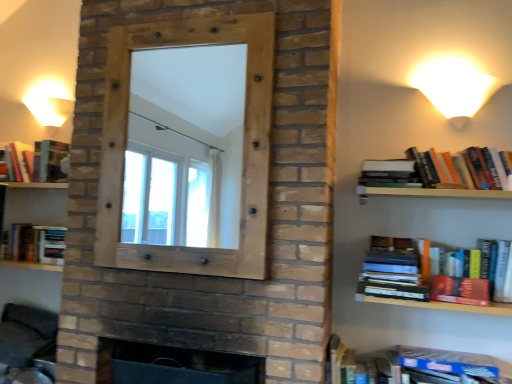
Question: Is dark brick fireplace at center further to camera compared to hardcover book at upper right, positioned as the 3th book in left-to-right order?

Choices:
 (A) no
 (B) yes

Answer: (A)

Question: From a real-world perspective, is dark brick fireplace at center over hardcover book at upper right, positioned as the 3th book in left-to-right order?

Choices:
 (A) no
 (B) yes

Answer: (A)

Question: Is hardcover book at upper right, positioned as the 3th book in left-to-right order, at the back of dark brick fireplace at center?

Choices:
 (A) no
 (B) yes

Answer: (A)

Question: Can you confirm if dark brick fireplace at center is shorter than hardcover book at upper right, positioned as the 3th book in top-to-bottom order?

Choices:
 (A) no
 (B) yes

Answer: (A)

Question: From the image's perspective, is dark brick fireplace at center over hardcover book at upper right, positioned as the 3th book in left-to-right order?

Choices:
 (A) yes
 (B) no

Answer: (B)

Question: Considering the positions of hardcover book at right and matte white lampshade at upper left, the 1th table lamp viewed from the left, in the image, is hardcover book at right wider or thinner than matte white lampshade at upper left, the 1th table lamp viewed from the left,?

Choices:
 (A) thin
 (B) wide

Answer: (B)

Question: From their relative heights in the image, would you say hardcover book at right is taller or shorter than matte white lampshade at upper left, the 1th table lamp viewed from the left?

Choices:
 (A) short
 (B) tall

Answer: (B)

Question: Is hardcover book at right inside or outside of matte white lampshade at upper left, the 1th table lamp viewed from the left?

Choices:
 (A) outside
 (B) inside

Answer: (A)

Question: Considering the positions of hardcover book at right and matte white lampshade at upper left, the 2th table lamp viewed from the right, in the image, is hardcover book at right bigger or smaller than matte white lampshade at upper left, the 2th table lamp viewed from the right,?

Choices:
 (A) small
 (B) big

Answer: (B)

Question: Is white glossy table lamp at upper right, which ranks as the second table lamp in back-to-front order, in front of or behind wooden frame at center in the image?

Choices:
 (A) behind
 (B) front

Answer: (A)

Question: Considering the positions of point tap(453, 94) and point tap(246, 91), is point tap(453, 94) closer or farther from the camera than point tap(246, 91)?

Choices:
 (A) farther
 (B) closer

Answer: (A)

Question: Is white glossy table lamp at upper right, the 1th table lamp when ordered from right to left, to the left or to the right of wooden frame at center in the image?

Choices:
 (A) left
 (B) right

Answer: (B)

Question: Is white glossy table lamp at upper right, which is the 1th table lamp from front to back, bigger or smaller than wooden frame at center?

Choices:
 (A) small
 (B) big

Answer: (A)

Question: From a real-world perspective, is hardcover book at lower left, the second book in the bottom-to-top sequence, above or below wooden frame at center?

Choices:
 (A) above
 (B) below

Answer: (B)

Question: Considering the positions of hardcover book at lower left, which is counted as the 2th book, starting from the left, and wooden frame at center in the image, is hardcover book at lower left, which is counted as the 2th book, starting from the left, wider or thinner than wooden frame at center?

Choices:
 (A) thin
 (B) wide

Answer: (B)